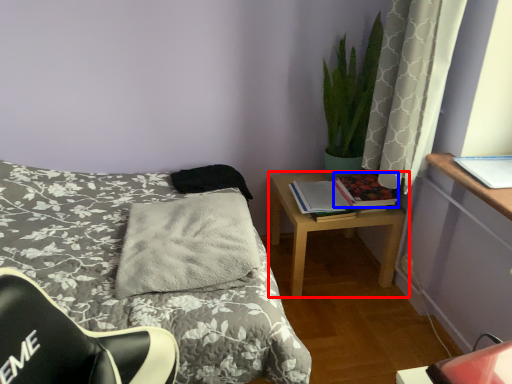
Question: Among these objects, which one is nearest to the camera, nightstand (highlighted by a red box) or book (highlighted by a blue box)?

Choices:
 (A) nightstand
 (B) book

Answer: (A)